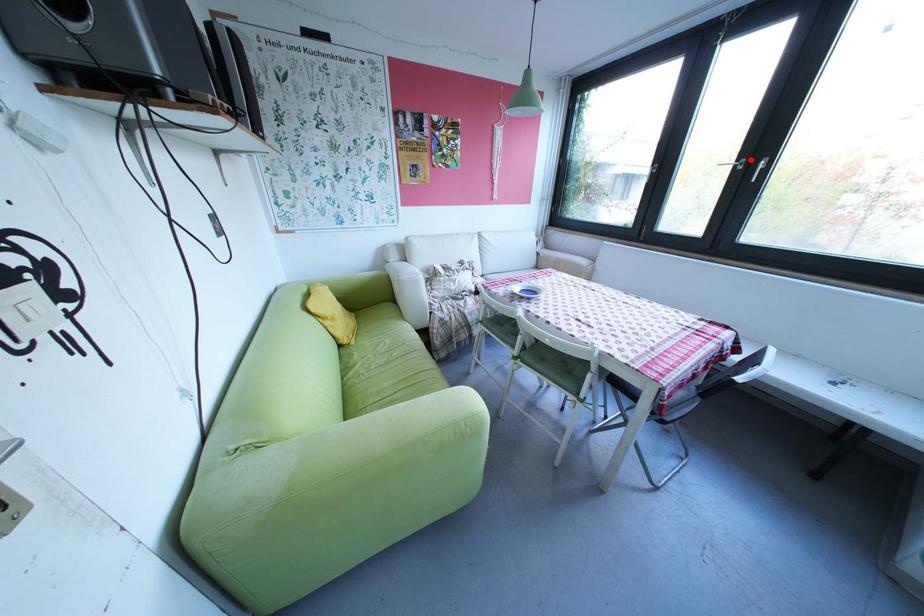
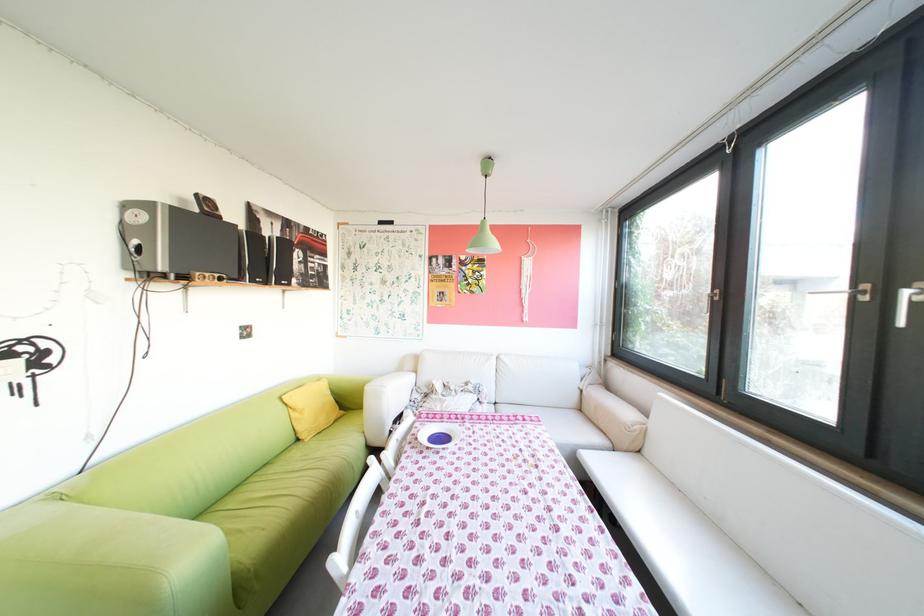
Locate, in the second image, the point that corresponds to the highlighted location in the first image.

(867, 285)